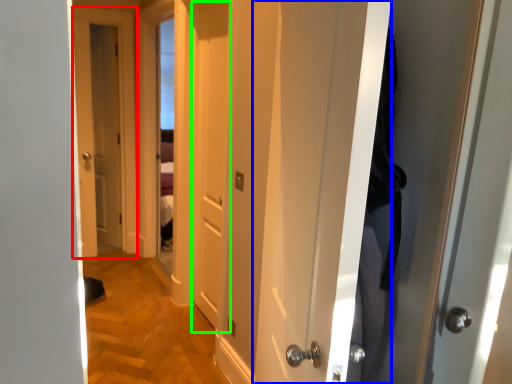
Question: Which object is positioned farthest from door (highlighted by a red box)? Select from door (highlighted by a blue box) and door (highlighted by a green box).

Choices:
 (A) door
 (B) door

Answer: (A)